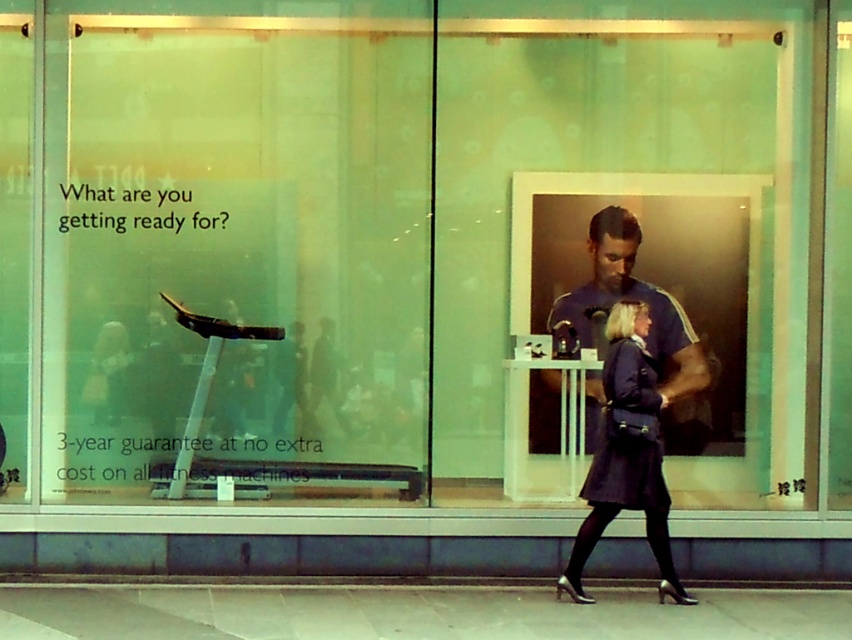
Question: Can you confirm if smooth concrete pavement at lower center is wider than dark blue fabric coat at lower center?

Choices:
 (A) no
 (B) yes

Answer: (B)

Question: Which is nearer to the dark blue fabric coat at lower center?

Choices:
 (A) smooth concrete pavement at lower center
 (B) blue athletic shirt at center

Answer: (B)

Question: Which object is positioned closest to the blue athletic shirt at center?

Choices:
 (A) dark blue fabric coat at lower center
 (B) smooth concrete pavement at lower center
 (C) dark blue fabric coat at center

Answer: (A)

Question: Considering the real-world distances, which object is closest to the smooth concrete pavement at lower center?

Choices:
 (A) dark blue fabric coat at center
 (B) dark blue fabric coat at lower center

Answer: (B)

Question: In this image, where is smooth concrete pavement at lower center located relative to dark blue fabric coat at center?

Choices:
 (A) right
 (B) left

Answer: (B)

Question: From the image, what is the correct spatial relationship of blue athletic shirt at center in relation to dark blue fabric coat at center?

Choices:
 (A) below
 (B) above

Answer: (B)